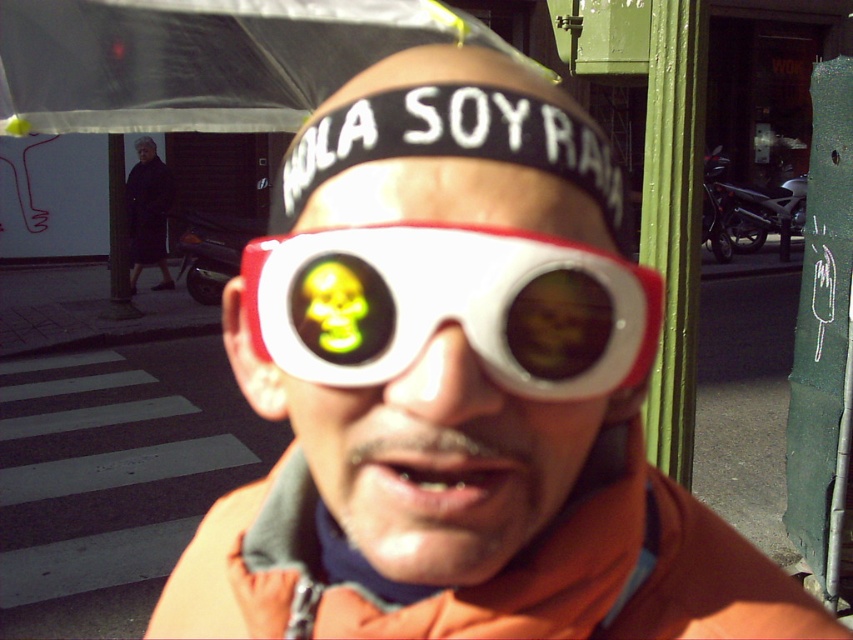
Does white matte sunglasses at center have a greater width compared to white plastic goggles at center?

Yes, white matte sunglasses at center is wider than white plastic goggles at center.

Which of these two, white matte sunglasses at center or white plastic goggles at center, stands shorter?

With less height is white plastic goggles at center.

Is point (412, 173) behind point (566, 392)?

That is False.

Identify the location of white matte sunglasses at center. This screenshot has width=853, height=640. (437, 461).

Does white matte sunglasses at center have a lesser height compared to dark wool coat at left?

Yes, white matte sunglasses at center is shorter than dark wool coat at left.

Which is behind, point (511, 397) or point (160, 236)?

Point (160, 236)

Is point (421, 170) in front of point (135, 259)?

Yes.

Find the location of `white matte sunglasses at center`. white matte sunglasses at center is located at coordinates (437, 461).

Can you confirm if brown matte eye at center is bigger than matte black sunglasses at center?

No, brown matte eye at center is not bigger than matte black sunglasses at center.

Measure the distance between point (552, 362) and camera.

Point (552, 362) is 40.31 centimeters away from camera.

Between point (520, 337) and point (148, 147), which one is positioned behind?

The point (148, 147) is behind.

Locate an element on the screen. This screenshot has width=853, height=640. brown matte eye at center is located at coordinates (560, 324).